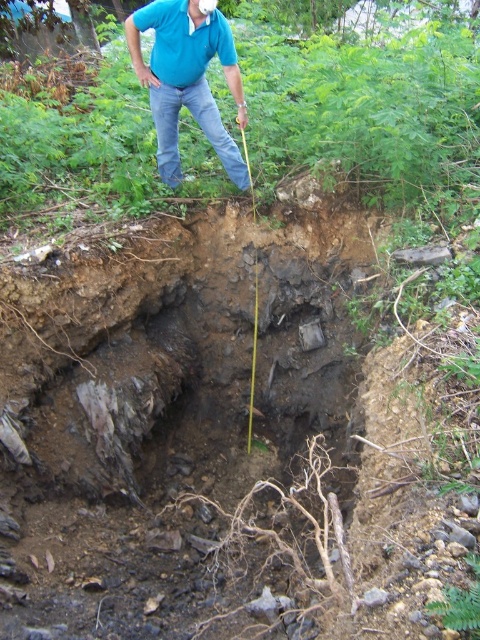
Question: Is blue cotton shirt at upper center to the left of jeans at upper center from the viewer's perspective?

Choices:
 (A) yes
 (B) no

Answer: (A)

Question: Which point is closer to the camera taking this photo?

Choices:
 (A) (152, 68)
 (B) (168, 104)

Answer: (A)

Question: Does blue cotton polo shirt at upper center have a lesser width compared to jeans at upper center?

Choices:
 (A) no
 (B) yes

Answer: (B)

Question: Which point is closer to the camera taking this photo?

Choices:
 (A) (223, 36)
 (B) (182, 72)
 (C) (165, 90)

Answer: (A)

Question: Does blue cotton shirt at upper center lie in front of blue cotton polo shirt at upper center?

Choices:
 (A) no
 (B) yes

Answer: (B)

Question: Which object is closer to the camera taking this photo?

Choices:
 (A) blue cotton polo shirt at upper center
 (B) jeans at upper center
 (C) blue cotton shirt at upper center

Answer: (C)